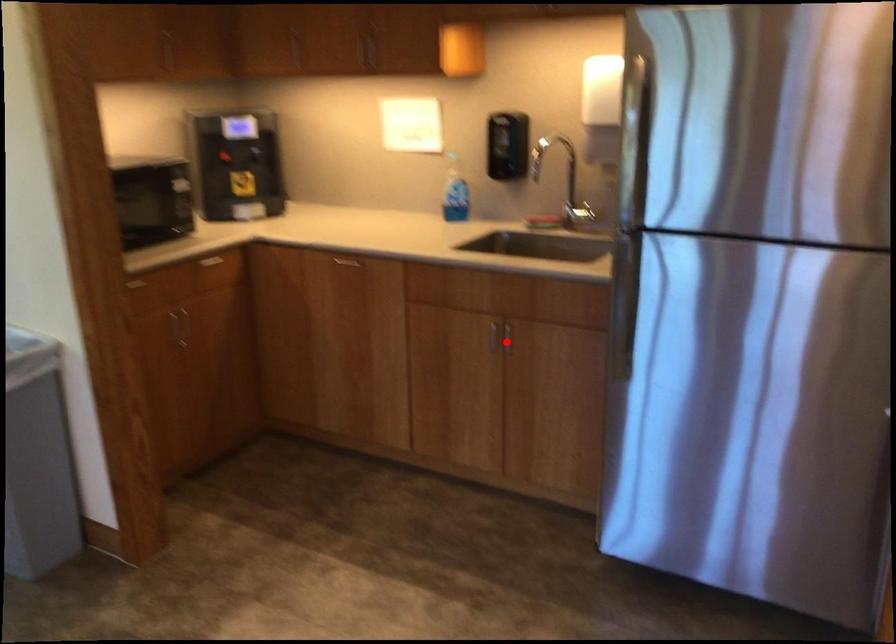
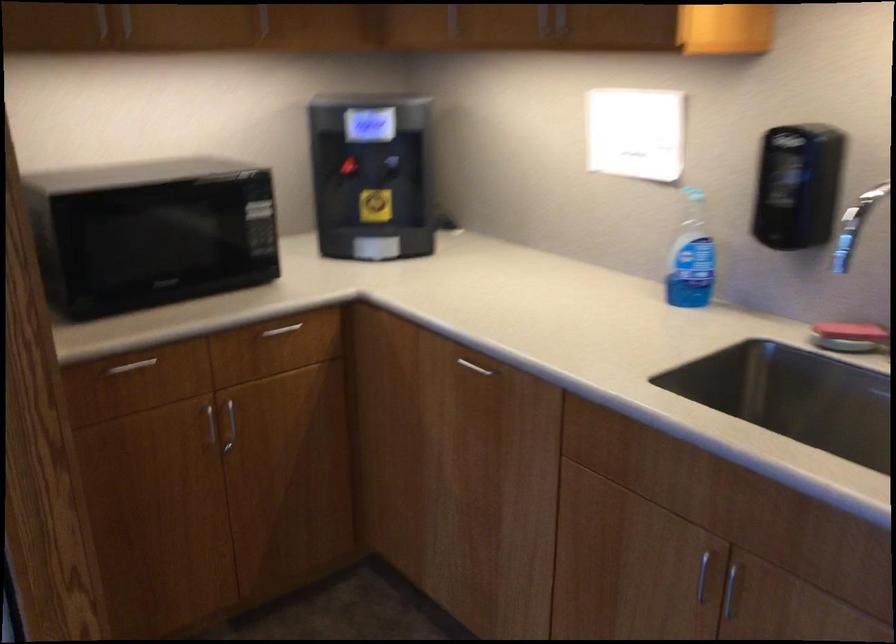
Question: I am providing you with two images of the same scene from different viewpoints. In image1, a red point is highlighted. Considering the same 3D point in image2, which of the following is correct?

Choices:
 (A) It is closer
 (B) It is farther

Answer: (A)